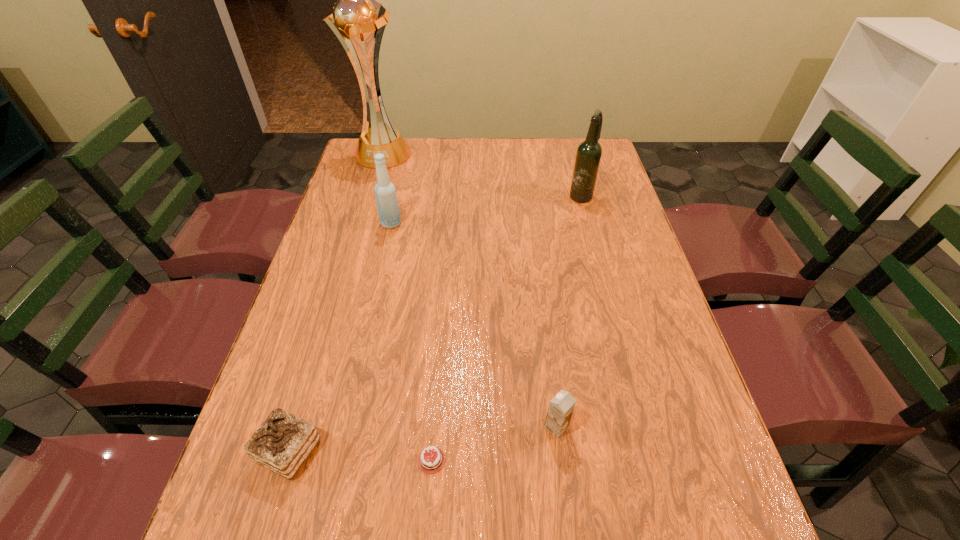
Locate an element on the screen. This screenshot has height=540, width=960. vacant area that lies between the tallest object and the second farthest object is located at coordinates (481, 174).

Locate an element on the screen. This screenshot has height=540, width=960. free space between the fifth nearest object and the farthest object is located at coordinates (481, 174).

Identify the location of free space that is in between the right chocolate cake and the fourth shortest object. (411, 342).

This screenshot has height=540, width=960. What are the coordinates of `free space between the trophy and the second object from right to left` in the screenshot? It's located at click(469, 290).

Image resolution: width=960 pixels, height=540 pixels. In order to click on free space between the chocolate milk and the second farthest object in this screenshot , I will do `click(568, 311)`.

Where is `vacant point located between the left chocolate cake and the shorter chocolate cake`? Image resolution: width=960 pixels, height=540 pixels. vacant point located between the left chocolate cake and the shorter chocolate cake is located at coordinates (360, 456).

Locate which object ranks fifth in proximity to the third tallest object. Please provide its 2D coordinates. Your answer should be formatted as a tuple, i.e. [(x, y)], where the tuple contains the x and y coordinates of a point satisfying the conditions above.

[(561, 407)]

Identify which object is the fifth closest to the beer bottle. Please provide its 2D coordinates. Your answer should be formatted as a tuple, i.e. [(x, y)], where the tuple contains the x and y coordinates of a point satisfying the conditions above.

[(282, 443)]

You are a GUI agent. You are given a task and a screenshot of the screen. Output one action in this format:
    pyautogui.click(x=<x>, y=<y>)
    Task: Click on the free region that satisfies the following two spatial constraints: 1. on the front-facing side of the trophy; 2. on the left side of the second object from right to left
    The width and height of the screenshot is (960, 540).
    Given the screenshot: What is the action you would take?
    pyautogui.click(x=302, y=427)

Find the location of a particular element. The height and width of the screenshot is (540, 960). free point that satisfies the following two spatial constraints: 1. on the back side of the left chocolate cake; 2. on the left side of the beer bottle is located at coordinates (367, 195).